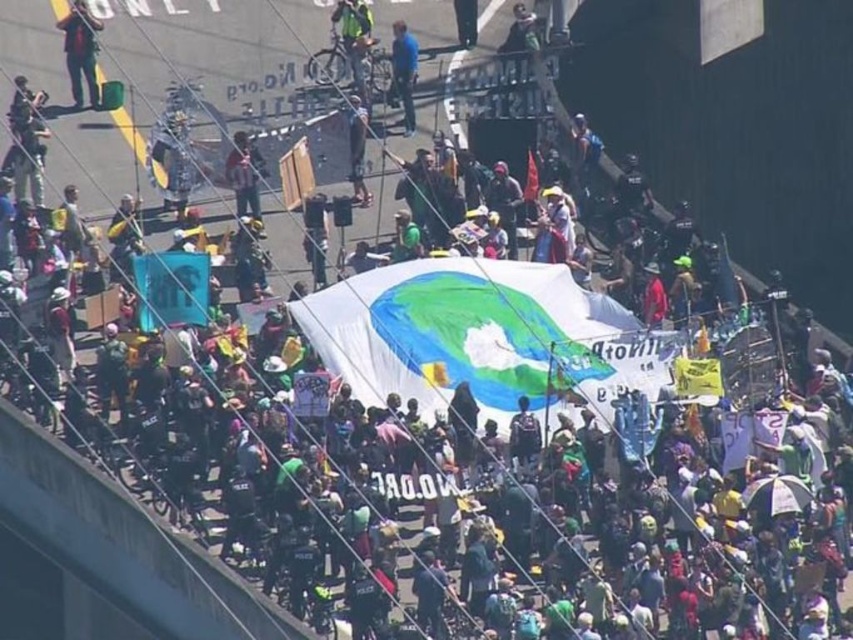
You are a photographer standing at the edge of the bridge, wanting to capture both the point at coordinate (x=91, y=20) and the point at coordinate (x=402, y=90) in your shot. Which point will appear larger in your photo?

Point (x=91, y=20) is closer to the viewer than point (x=402, y=90), so it will appear larger in the photo.

You are a photographer at the protest scene. You need to capture a photo that includes both the matte black pants at upper left and the blue fabric at center. Based on their positions, which object should you focus on first to ensure both are in the frame?

The matte black pants at upper left is located above the blue fabric at center, so you should focus on the matte black pants at upper left first to ensure both are in the frame.